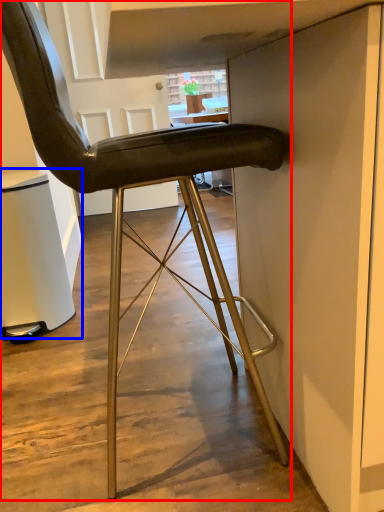
Question: Which object appears farthest to the camera in this image, chair (highlighted by a red box) or cabinetry (highlighted by a blue box)?

Choices:
 (A) chair
 (B) cabinetry

Answer: (B)